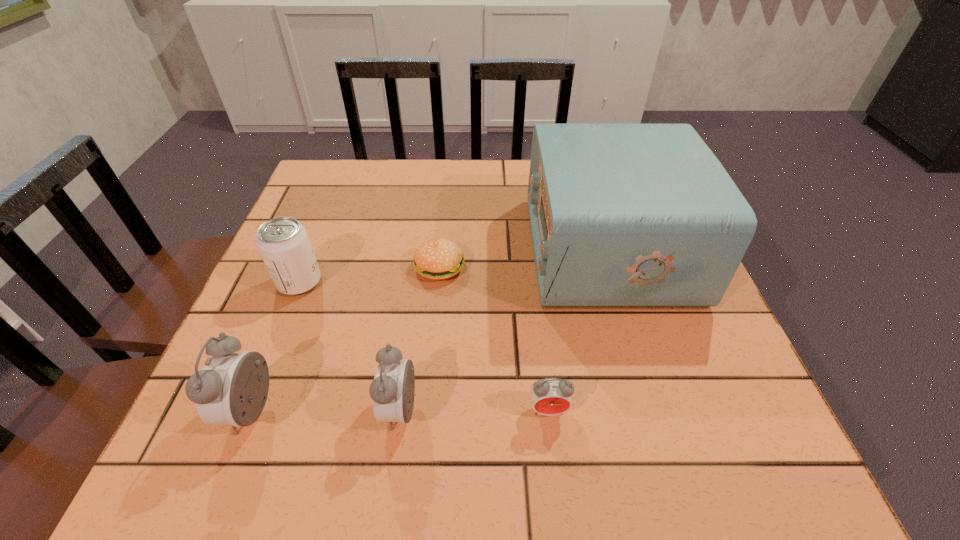
In order to click on object at the far right corner in this screenshot , I will do (x=622, y=215).

You are a GUI agent. You are given a task and a screenshot of the screen. Output one action in this format:
    pyautogui.click(x=<x>, y=<y>)
    Task: Click on the vacant space at the far edge
    
    Given the screenshot: What is the action you would take?
    pyautogui.click(x=497, y=185)

In order to click on free space at the near edge in this screenshot , I will do `click(455, 394)`.

At what (x,y) coordinates should I click in order to perform the action: click on vacant region at the left edge of the desktop. Please return your answer as a coordinate pair (x, y). Image resolution: width=960 pixels, height=540 pixels. Looking at the image, I should click on (250, 321).

Locate an element on the screen. Image resolution: width=960 pixels, height=540 pixels. blank space at the far left corner is located at coordinates (301, 210).

The height and width of the screenshot is (540, 960). Find the location of `free spot between the rightmost alarm clock and the soda can`. free spot between the rightmost alarm clock and the soda can is located at coordinates (424, 346).

The image size is (960, 540). In order to click on free point between the leftmost alarm clock and the second tallest alarm clock in this screenshot , I will do `click(326, 411)`.

This screenshot has height=540, width=960. In order to click on free space between the soda can and the patty in this screenshot , I will do `click(370, 274)`.

You are a GUI agent. You are given a task and a screenshot of the screen. Output one action in this format:
    pyautogui.click(x=<x>, y=<y>)
    Task: Click on the free area in between the second alarm clock from left to right and the soda can
    This screenshot has width=960, height=540.
    Given the screenshot: What is the action you would take?
    pyautogui.click(x=350, y=347)

Identify the location of blank region between the second alarm clock from right to left and the leftmost alarm clock. (326, 411).